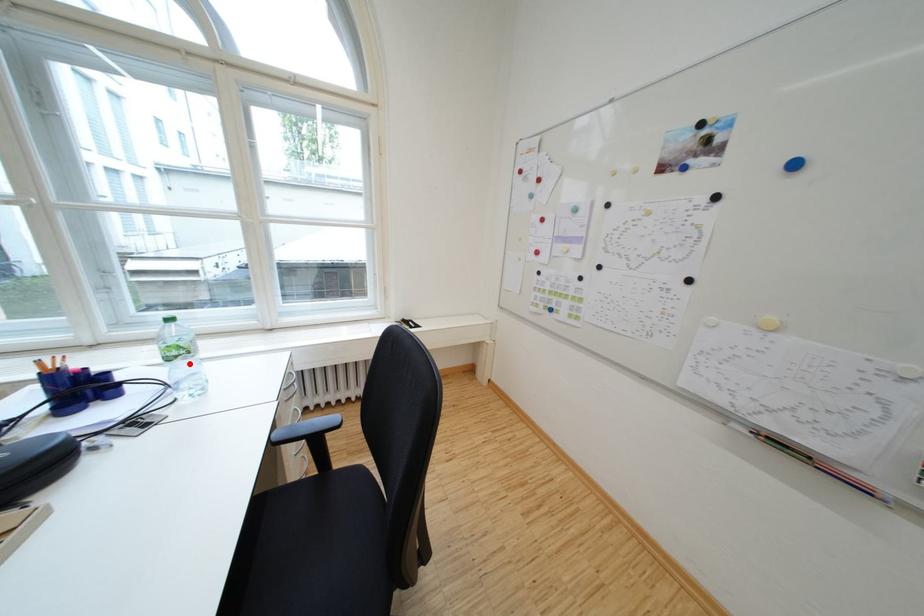
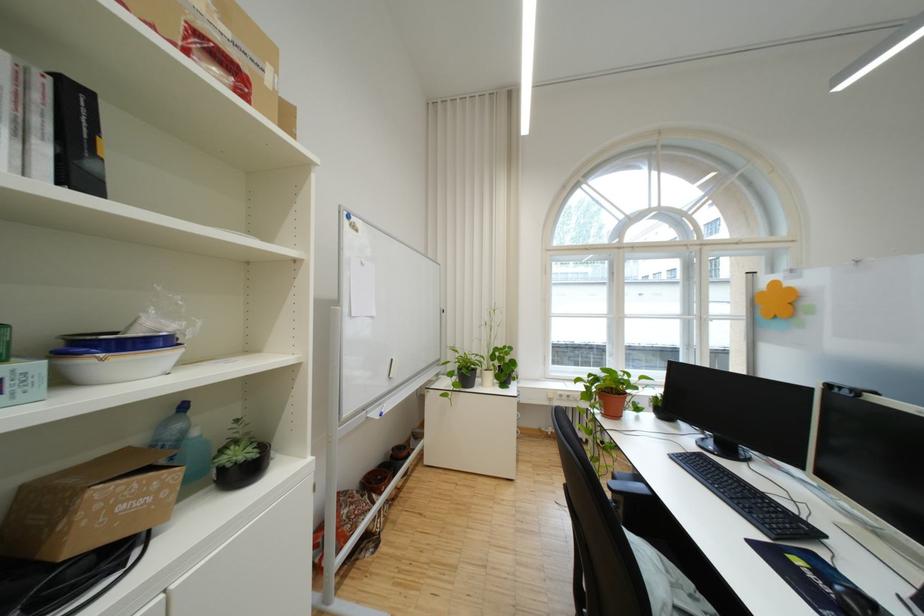
Question: I am providing you with two images of the same scene from different viewpoints. A red point is marked on the first image. At the location where the point appears in image 1, is it still visible in image 2?

Choices:
 (A) Yes
 (B) No

Answer: (B)